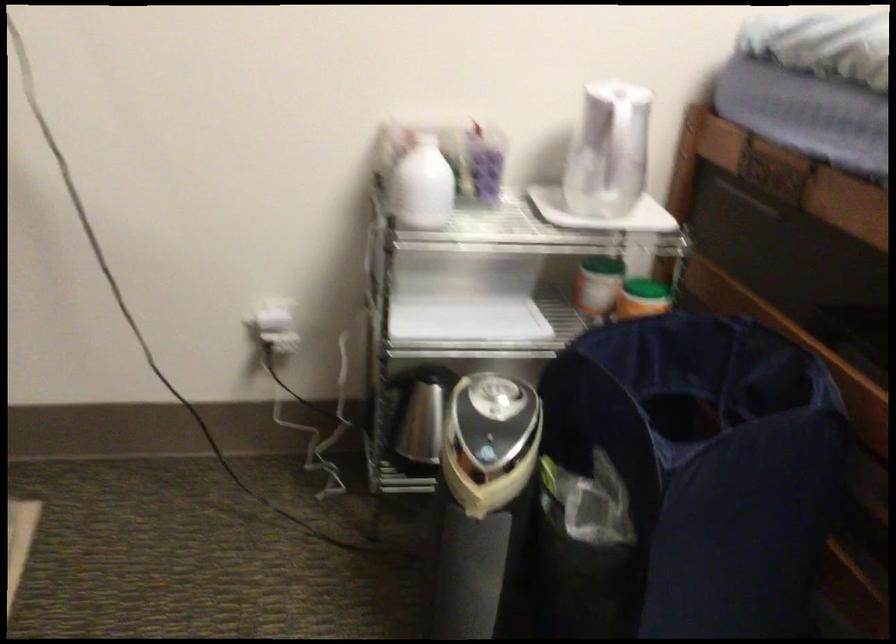
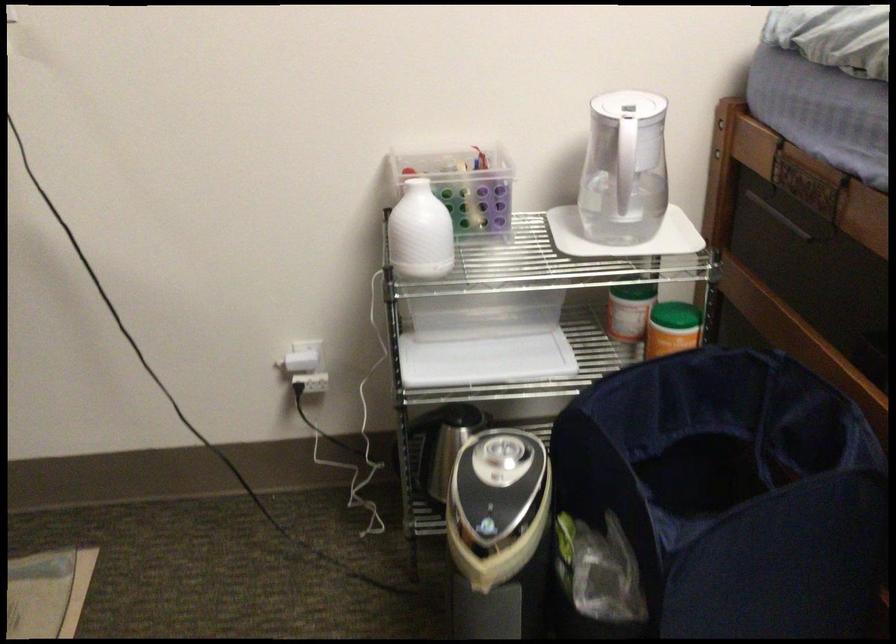
Locate, in the second image, the point that corresponds to (616,145) in the first image.

(625, 167)